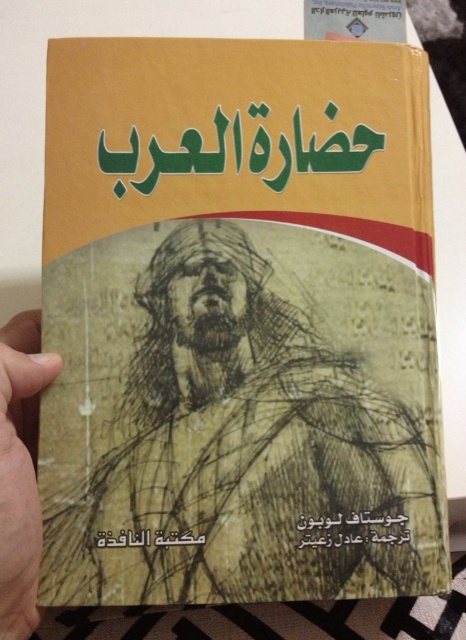
Based on the photo, you are looking at the book cover and want to know which of the two points, point (34,484) or point (408,536), is closer to your eyes. Based on the book cover layout described, which point is nearer?

Point (34,484) is closer to the camera than point (408,536).

You are a book designer who needs to place a new element on the book cover. The current elements are a skinny flesh at lower left and a black paper at center. How far apart are these two elements?

The skinny flesh at lower left is 6.67 inches from the black paper at center.

You are an artist trying to sketch the book cover. You notice the skinny flesh at lower left and the black paper at center. Which object is narrower in width?

The skinny flesh at lower left has a lesser width compared to black paper at center, so the skinny flesh at lower left is narrower.